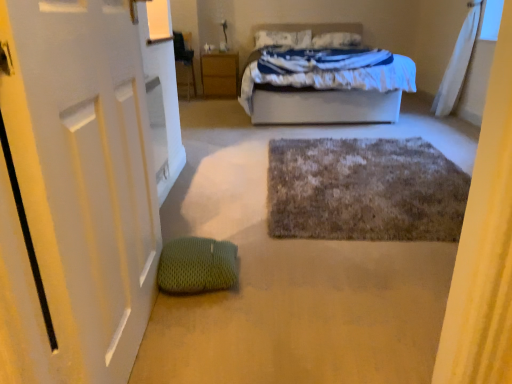
Question: In the image, is white soft bed at center on the left side or the right side of white matte door at left?

Choices:
 (A) right
 (B) left

Answer: (A)

Question: Is white soft bed at center inside the boundaries of white matte door at left, or outside?

Choices:
 (A) inside
 (B) outside

Answer: (B)

Question: Which object is positioned closest to the fuzzy gray bath mat at center?

Choices:
 (A) wooden nightstand at center
 (B) white matte door at left
 (C) white soft pillow at upper center, which is counted as the first pillow, starting from the left
 (D) green textured bean bag at lower left
 (E) white soft bed at center

Answer: (D)

Question: Estimate the real-world distances between objects in this image. Which object is farther from the white sheer curtain at upper right?

Choices:
 (A) green textured bean bag at lower left
 (B) fuzzy gray bath mat at center
 (C) wooden nightstand at center
 (D) white soft pillow at upper center, the 1th pillow from the right
 (E) white matte door at left

Answer: (E)